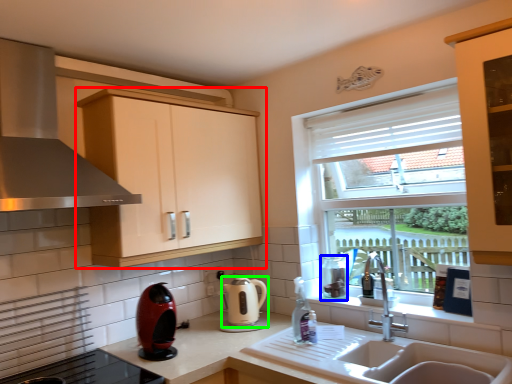
Question: Based on their relative distances, which object is farther from cabinetry (highlighted by a red box)? Choose from appliance (highlighted by a blue box) and kitchen appliance (highlighted by a green box).

Choices:
 (A) appliance
 (B) kitchen appliance

Answer: (A)